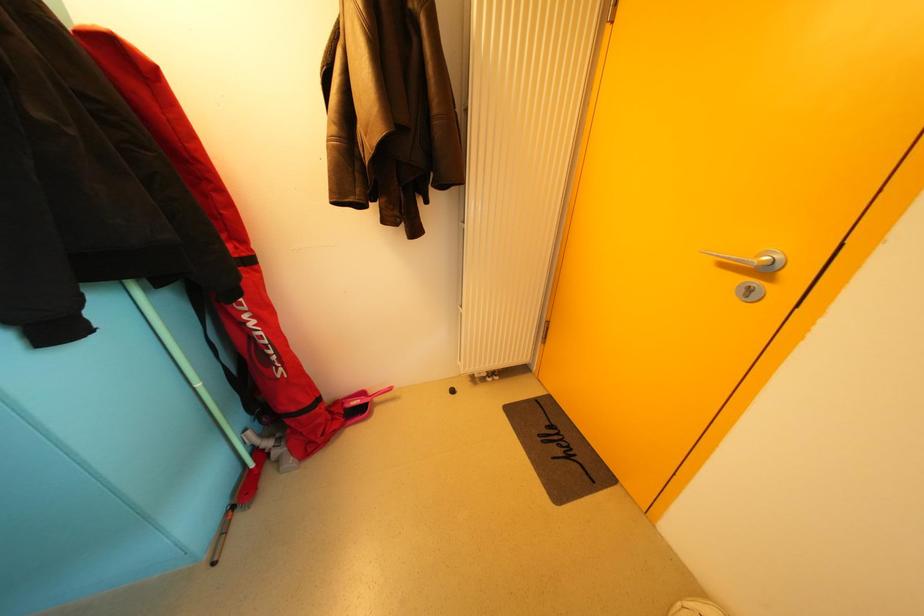
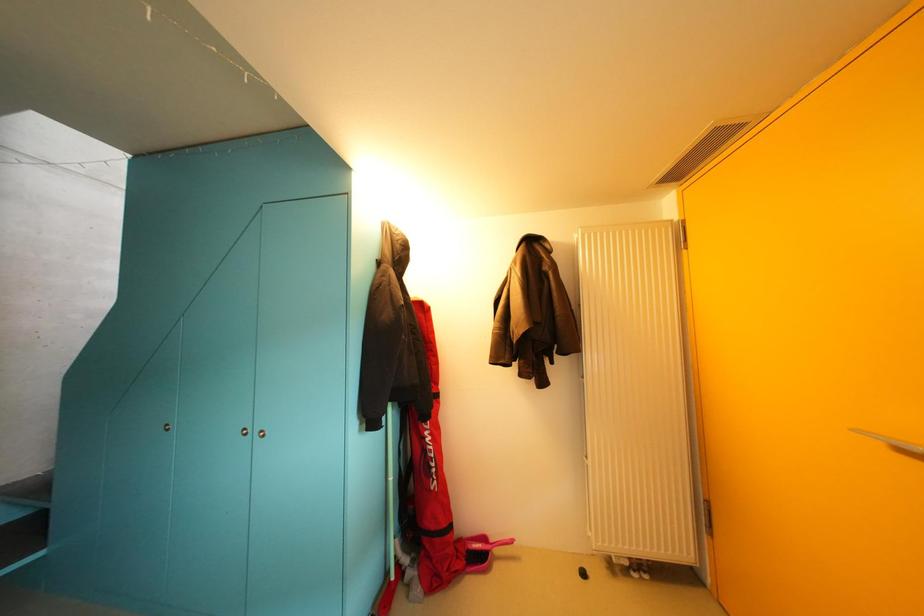
Based on the continuous images, in which direction is the camera rotating?

The rotation direction of the camera is left-up.